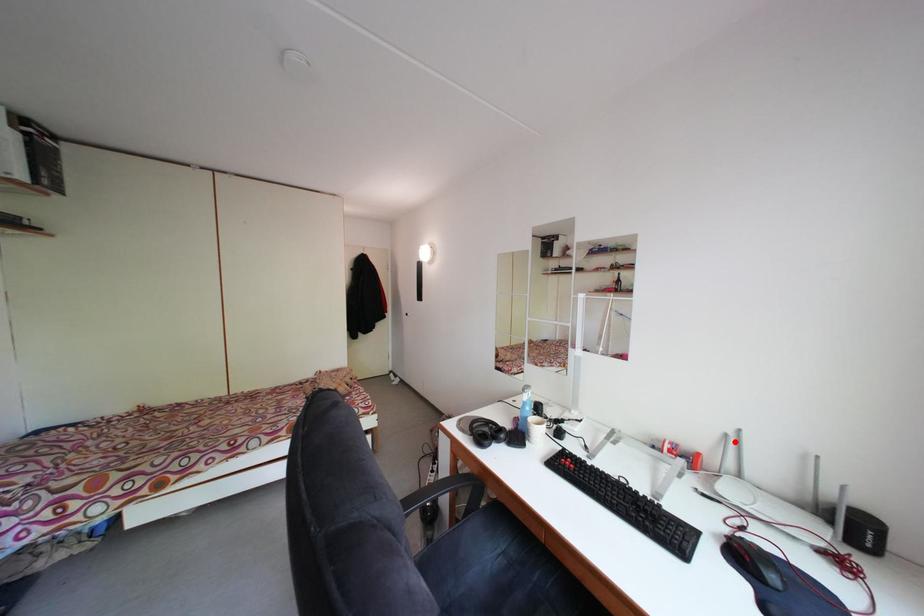
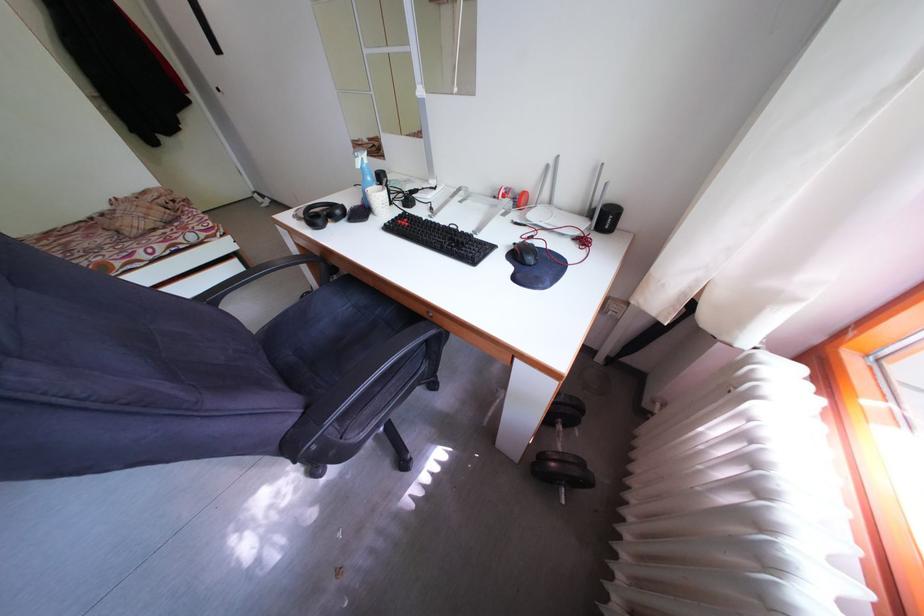
Find the pixel in the second image that matches the highlighted location in the first image.

(555, 172)